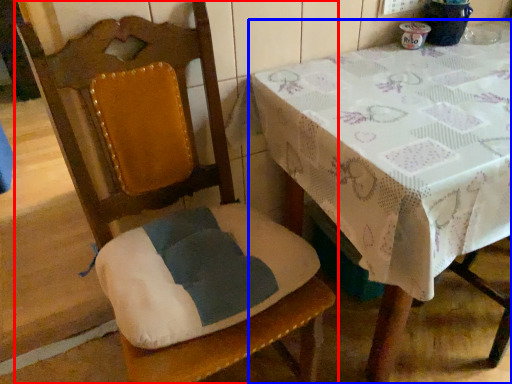
Question: Which object is further to the camera taking this photo, chair (highlighted by a red box) or table (highlighted by a blue box)?

Choices:
 (A) chair
 (B) table

Answer: (B)